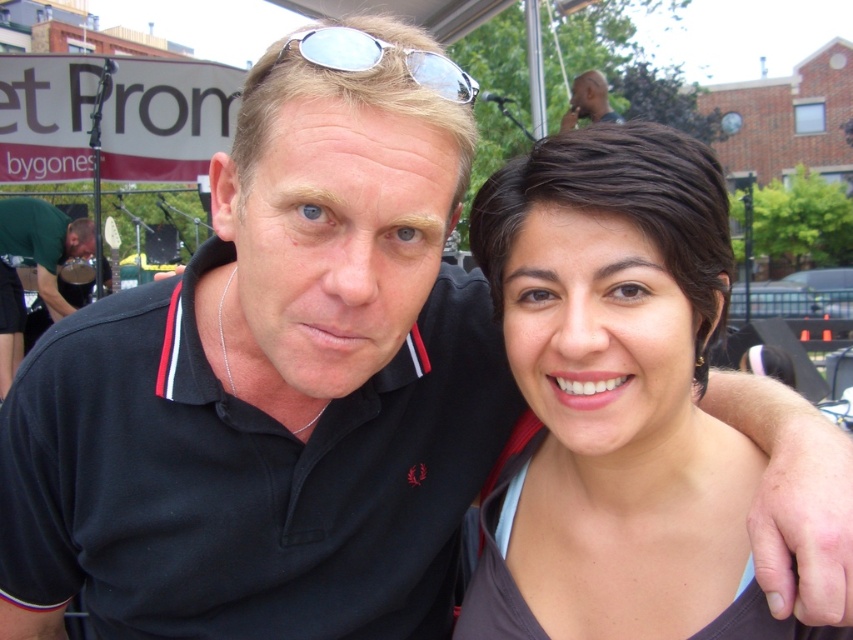
How far apart are green matte shirt at left and smooth skin head at upper center?

green matte shirt at left is 6.06 meters from smooth skin head at upper center.

Can you confirm if green matte shirt at left is positioned to the left of smooth skin head at upper center?

Indeed, green matte shirt at left is positioned on the left side of smooth skin head at upper center.

Is point (44, 289) behind point (606, 90)?

No.

The width and height of the screenshot is (853, 640). In order to click on green matte shirt at left in this screenshot , I will do `click(35, 268)`.

Is point (521, 480) positioned after point (573, 100)?

That is False.

Does matte black hair at center appear on the left side of smooth skin head at upper center?

Indeed, matte black hair at center is positioned on the left side of smooth skin head at upper center.

This screenshot has width=853, height=640. Find the location of `matte black hair at center`. matte black hair at center is located at coordinates (614, 401).

How far apart are matte black hair at center and silver reflective sunglasses at upper center?

A distance of 19.50 inches exists between matte black hair at center and silver reflective sunglasses at upper center.

Does matte black hair at center appear under silver reflective sunglasses at upper center?

Correct, matte black hair at center is located below silver reflective sunglasses at upper center.

Does point (666, 589) come closer to viewer compared to point (374, 48)?

That is False.

You are a GUI agent. You are given a task and a screenshot of the screen. Output one action in this format:
    pyautogui.click(x=<x>, y=<y>)
    Task: Click on the matte black hair at center
    
    Given the screenshot: What is the action you would take?
    (x=614, y=401)